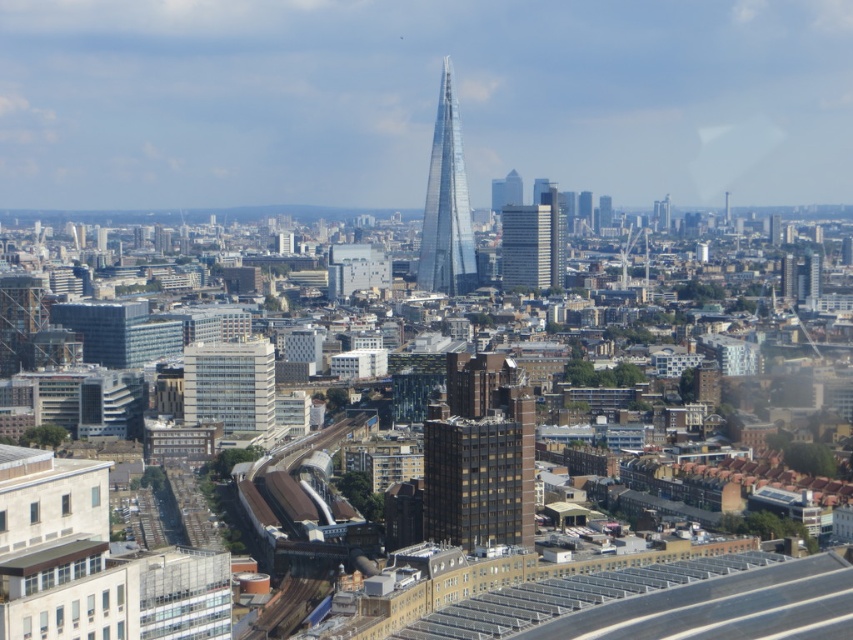
Question: Considering the relative positions of transparent glass tower at center and white glass skyscraper at center in the image provided, where is transparent glass tower at center located with respect to white glass skyscraper at center?

Choices:
 (A) left
 (B) right

Answer: (A)

Question: Which of the following is the closest to the observer?

Choices:
 (A) (207, 410)
 (B) (549, 216)
 (C) (462, 428)
 (D) (518, 259)

Answer: (C)

Question: Which point is closer to the camera?

Choices:
 (A) (548, 184)
 (B) (541, 278)
 (C) (445, 163)

Answer: (C)

Question: Does transparent glass tower at center come behind white glass skyscraper at center?

Choices:
 (A) no
 (B) yes

Answer: (A)

Question: Which of these objects is positioned farthest from the white glass building at center?

Choices:
 (A) white glass skyscraper at center
 (B) brown brick building at center
 (C) transparent glass tower at center
 (D) glassy steel skyscraper at center

Answer: (D)

Question: In this image, where is transparent glass tower at center located relative to glassy steel skyscraper at center?

Choices:
 (A) left
 (B) right

Answer: (A)